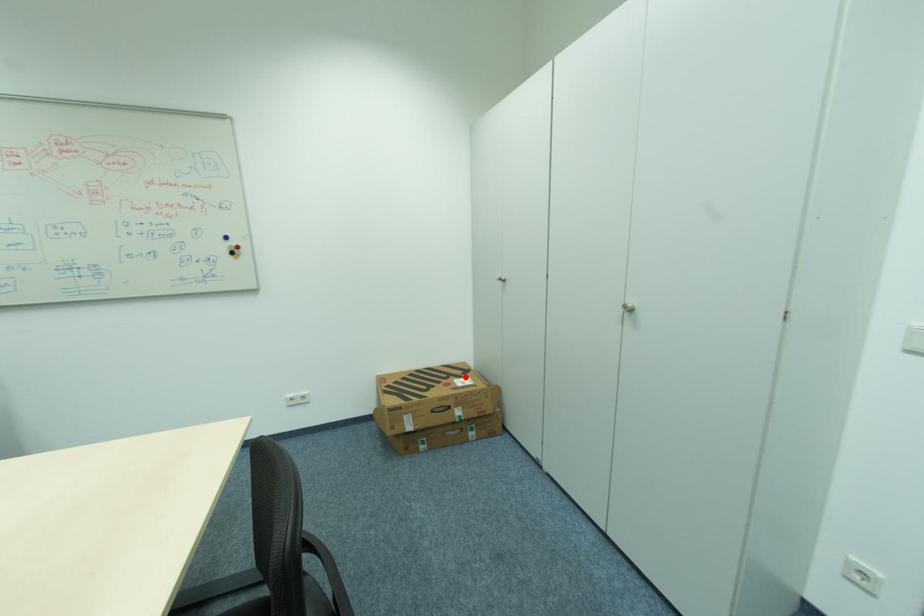
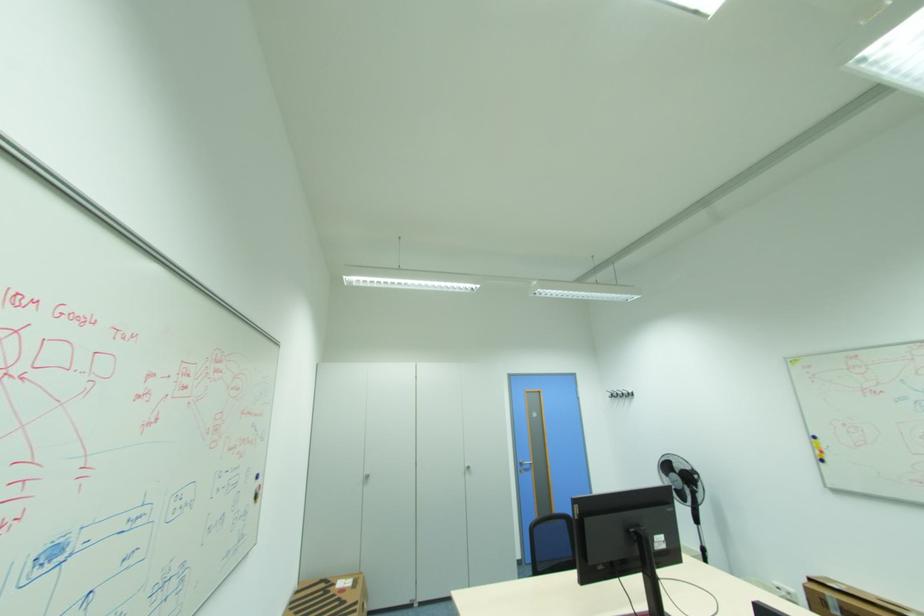
Question: I am providing you with two images of the same scene from different viewpoints. A red point is marked on the first image. Is the red point's position out of view in image 2?

Choices:
 (A) Yes
 (B) No

Answer: (B)